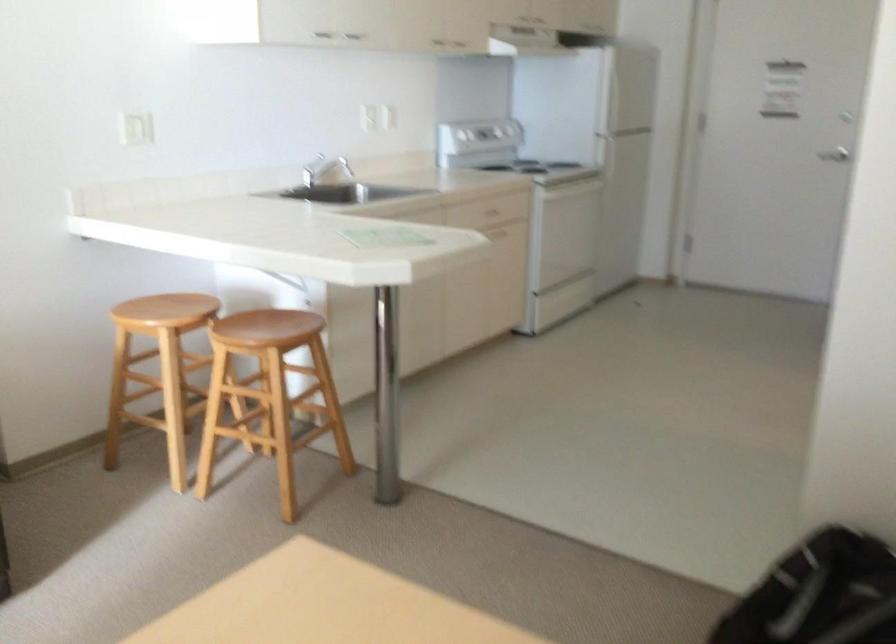
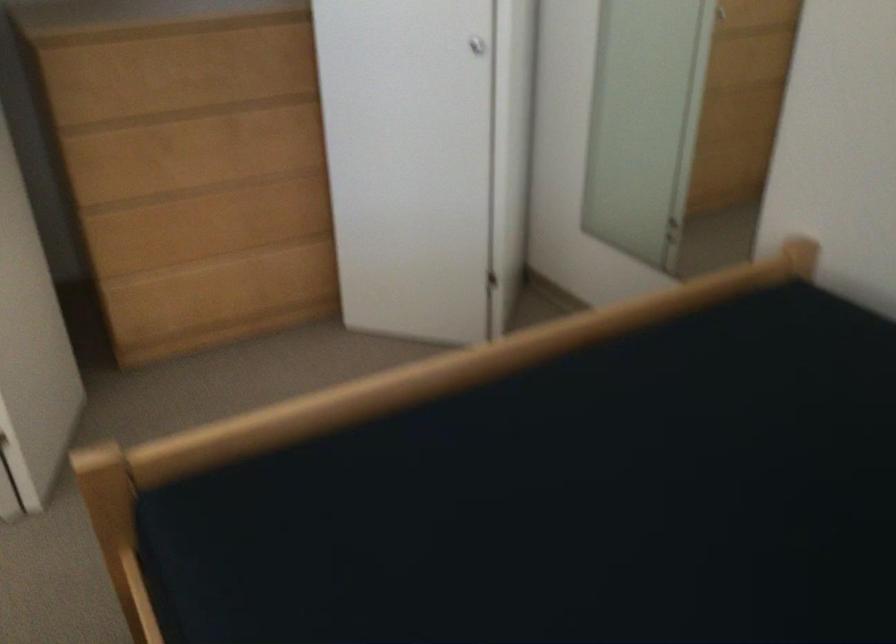
Based on the photo, how did the camera likely rotate?

The rotation direction of the camera is right-down.